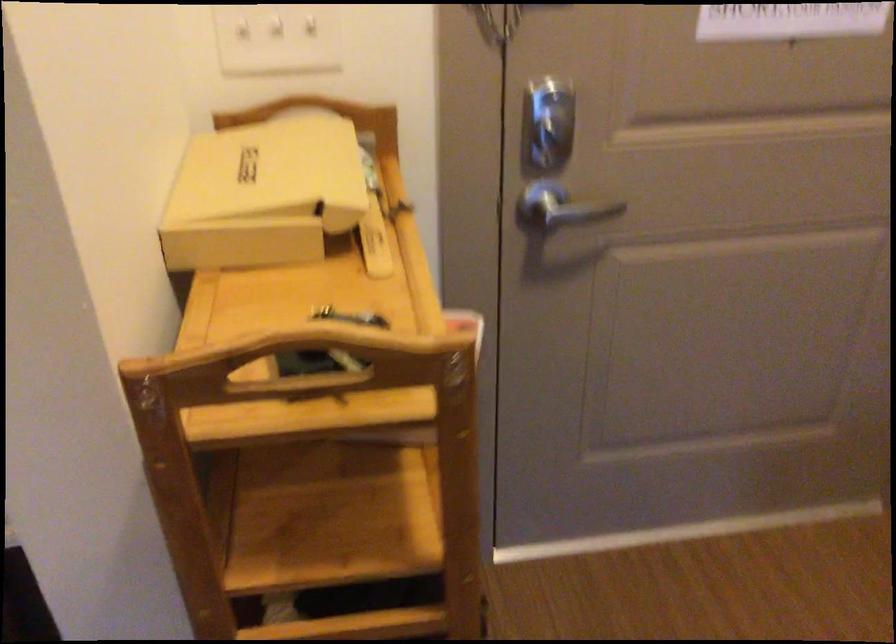
Find where to pull the cart handle cutout. Please return your answer as a coordinate pair (x, y).

(300, 364)